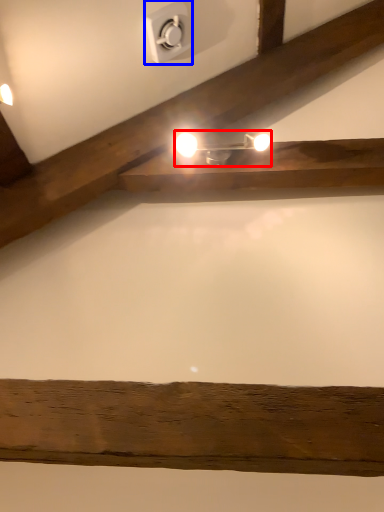
Question: Which of the following is the closest to the observer, lamp (highlighted by a red box) or electric outlet (highlighted by a blue box)?

Choices:
 (A) lamp
 (B) electric outlet

Answer: (B)